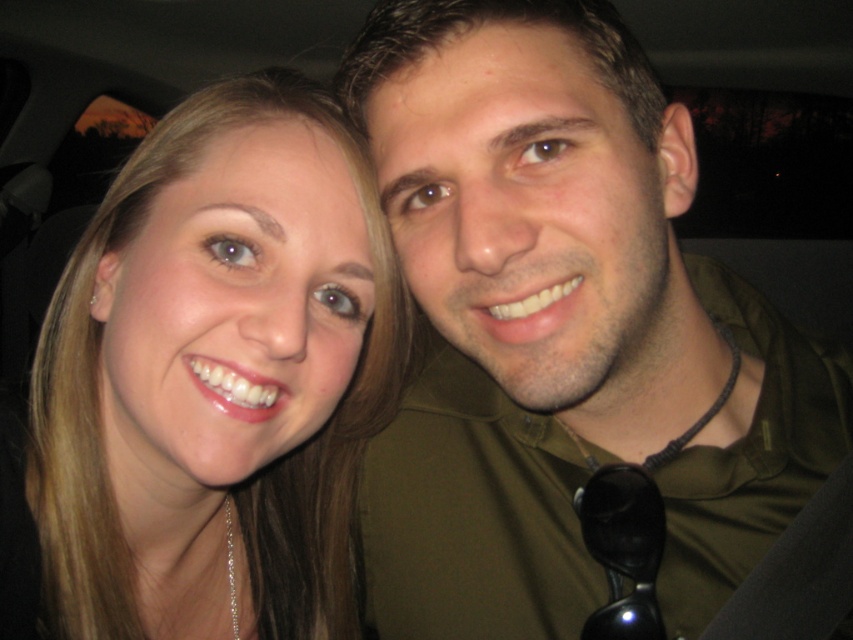
Can you confirm if matte green shirt at center is thinner than matte gold necklace at left?

Incorrect, matte green shirt at center's width is not less than matte gold necklace at left's.

Between matte green shirt at center and matte gold necklace at left, which one is positioned higher?

matte gold necklace at left

The width and height of the screenshot is (853, 640). Find the location of `matte green shirt at center`. matte green shirt at center is located at coordinates (564, 330).